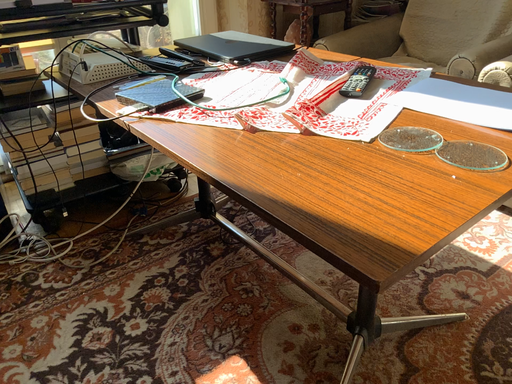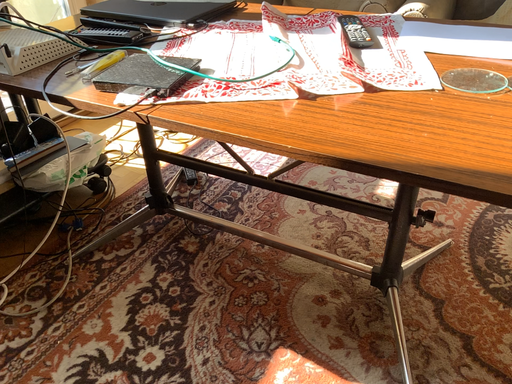
Question: How did the camera likely rotate when shooting the video?

Choices:
 (A) rotated left
 (B) rotated right

Answer: (B)